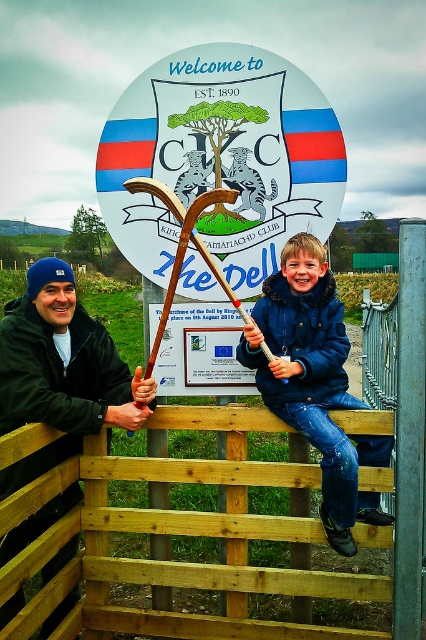
Question: Is yellow wooden fence at center positioned before blue fuzzy jacket at upper center?

Choices:
 (A) no
 (B) yes

Answer: (B)

Question: Estimate the real-world distances between objects in this image. Which object is farther from the blue fuzzy jacket at upper center?

Choices:
 (A) yellow wooden fence at center
 (B) dark blue knit cap at left
 (C) white plastic sign at center

Answer: (B)

Question: Does white plastic sign at center appear on the left side of dark blue knit cap at left?

Choices:
 (A) no
 (B) yes

Answer: (A)

Question: Is yellow wooden fence at center below blue fuzzy jacket at upper center?

Choices:
 (A) yes
 (B) no

Answer: (A)

Question: Which object is the closest to the yellow wooden fence at center?

Choices:
 (A) dark blue knit cap at left
 (B) white plastic sign at center

Answer: (A)

Question: Which point is farther from the camera taking this photo?

Choices:
 (A) (187, 131)
 (B) (270, 284)
 (C) (115, 608)

Answer: (A)